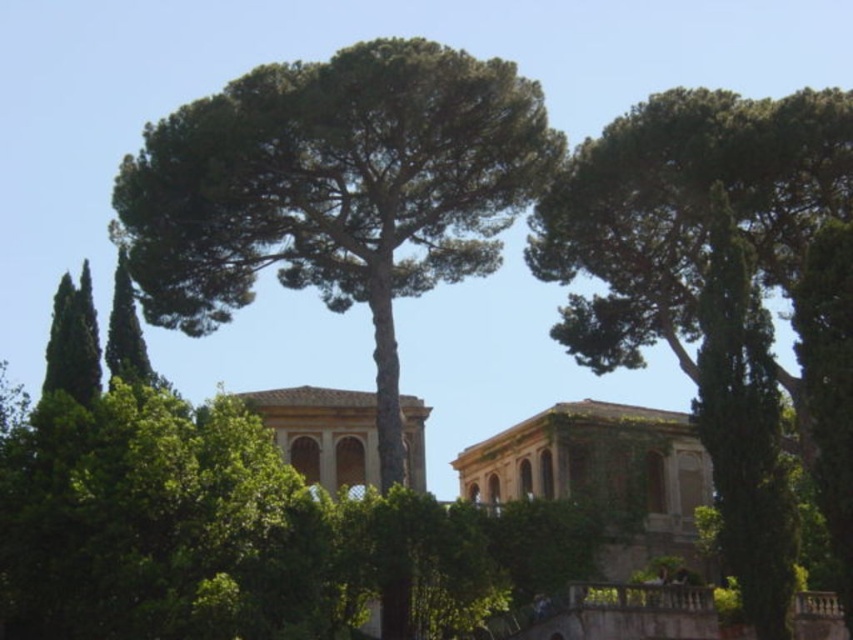
Describe the element at coordinates (335, 189) in the screenshot. I see `green leafy tree at center` at that location.

Does green leafy tree at center appear on the left side of green leafy tree at upper center?

Yes, green leafy tree at center is to the left of green leafy tree at upper center.

Which is behind, point (402, 109) or point (824, 493)?

Point (402, 109)

Identify the location of green leafy tree at center. (335, 189).

From the picture: Does green leafy tree at upper center have a smaller size compared to stone/brick palace at center?

Incorrect, green leafy tree at upper center is not smaller in size than stone/brick palace at center.

Between green leafy tree at upper center and stone/brick palace at center, which one has more height?

Standing taller between the two is green leafy tree at upper center.

Identify the location of green leafy tree at upper center. The image size is (853, 640). (717, 253).

Identify the location of green leafy tree at upper center. (717, 253).

In the scene shown: Between green leafy tree at center and stone/brick palace at center, which one has more height?

Standing taller between the two is green leafy tree at center.

Is green leafy tree at center smaller than stone/brick palace at center?

Incorrect, green leafy tree at center is not smaller in size than stone/brick palace at center.

Is point (114, 188) closer to camera compared to point (349, 422)?

Yes, point (114, 188) is in front of point (349, 422).

You are a GUI agent. You are given a task and a screenshot of the screen. Output one action in this format:
    pyautogui.click(x=<x>, y=<y>)
    Task: Click on the green leafy tree at center
    Image resolution: width=853 pixels, height=640 pixels.
    Given the screenshot: What is the action you would take?
    pyautogui.click(x=335, y=189)